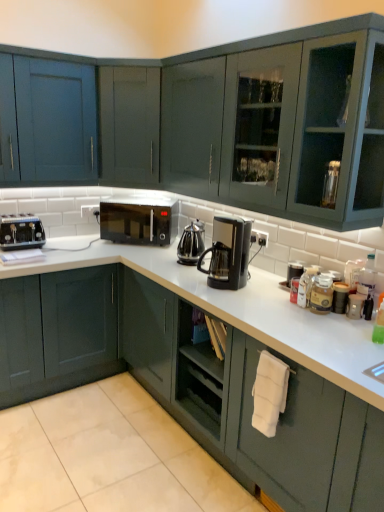
Find the location of a particular element. The height and width of the screenshot is (512, 384). matte black toaster at left is located at coordinates (21, 232).

Find the location of a particular element. The width and height of the screenshot is (384, 512). black plastic coffee maker at center is located at coordinates (228, 253).

The width and height of the screenshot is (384, 512). Describe the element at coordinates (57, 332) in the screenshot. I see `matte dark green cabinet at lower left, which ranks as the first cabinetry in bottom-to-top order` at that location.

This screenshot has width=384, height=512. What do you see at coordinates (288, 432) in the screenshot?
I see `white matte towel at lower right` at bounding box center [288, 432].

The height and width of the screenshot is (512, 384). I want to click on metallic silver canister at right, so click(355, 306).

Considering the positions of objects black matte microwave at center and metallic silver canister at right in the image provided, who is more to the right, black matte microwave at center or metallic silver canister at right?

metallic silver canister at right is more to the right.

Considering the sizes of objects black matte microwave at center and metallic silver canister at right in the image provided, who is bigger, black matte microwave at center or metallic silver canister at right?

With larger size is black matte microwave at center.

From a real-world perspective, is black matte microwave at center positioned under metallic silver canister at right based on gravity?

Actually, black matte microwave at center is physically above metallic silver canister at right in the real world.

Measure the distance between metallic silver canister at right and matte blue cabinet at upper left, placed as the first cabinetry when sorted from top to bottom.

metallic silver canister at right is 2.07 meters from matte blue cabinet at upper left, placed as the first cabinetry when sorted from top to bottom.

Does metallic silver canister at right have a greater width compared to matte blue cabinet at upper left, placed as the first cabinetry when sorted from top to bottom?

Incorrect, the width of metallic silver canister at right does not surpass that of matte blue cabinet at upper left, placed as the first cabinetry when sorted from top to bottom.

Based on their positions, is metallic silver canister at right located to the left or right of matte blue cabinet at upper left, acting as the second cabinetry starting from the bottom?

metallic silver canister at right is to the right of matte blue cabinet at upper left, acting as the second cabinetry starting from the bottom.

I want to click on cabinetry beneath the black matte microwave at center (from a real-world perspective), so click(x=57, y=332).

Is matte dark green cabinet at lower left, arranged as the second cabinetry when viewed from the top, next to black matte microwave at center?

No, matte dark green cabinet at lower left, arranged as the second cabinetry when viewed from the top, is not next to black matte microwave at center.

Is matte dark green cabinet at lower left, arranged as the second cabinetry when viewed from the top, shorter than black matte microwave at center?

Result: Incorrect, the height of matte dark green cabinet at lower left, arranged as the second cabinetry when viewed from the top, does not fall short of that of black matte microwave at center.

Can you tell me how much matte dark green cabinet at lower left, which ranks as the first cabinetry in bottom-to-top order, and black matte microwave at center differ in facing direction?

41.8 degrees separate the facing orientations of matte dark green cabinet at lower left, which ranks as the first cabinetry in bottom-to-top order, and black matte microwave at center.

Is matte blue cabinet at upper left, placed as the first cabinetry when sorted from top to bottom, placed right next to black plastic coffee pot at center?

They are not placed beside each other.

From the image's perspective, which is above, matte blue cabinet at upper left, placed as the first cabinetry when sorted from top to bottom, or black plastic coffee pot at center?

matte blue cabinet at upper left, placed as the first cabinetry when sorted from top to bottom, appears higher in the image.

Can you tell me how much matte blue cabinet at upper left, acting as the second cabinetry starting from the bottom, and black plastic coffee pot at center differ in facing direction?

The angular difference between matte blue cabinet at upper left, acting as the second cabinetry starting from the bottom, and black plastic coffee pot at center is 85.1 degrees.

How many degrees apart are the facing directions of matte black toaster at left and black matte microwave at center?

There is a 46.7-degree angle between the facing directions of matte black toaster at left and black matte microwave at center.

Considering the sizes of objects matte black toaster at left and black matte microwave at center in the image provided, who is wider, matte black toaster at left or black matte microwave at center?

black matte microwave at center is wider.

Does matte black toaster at left touch black matte microwave at center?

matte black toaster at left is not next to black matte microwave at center, and they're not touching.

Is black matte microwave at center a part of matte black toaster at left?

That's incorrect, black matte microwave at center is not inside matte black toaster at left.

From the picture: Considering the positions of objects matte blue cabinet at upper left, acting as the second cabinetry starting from the bottom, and black matte microwave at center in the image provided, who is behind, matte blue cabinet at upper left, acting as the second cabinetry starting from the bottom, or black matte microwave at center?

black matte microwave at center is behind.

Is matte blue cabinet at upper left, acting as the second cabinetry starting from the bottom, taller than black matte microwave at center?

Correct, matte blue cabinet at upper left, acting as the second cabinetry starting from the bottom, is much taller as black matte microwave at center.

Is matte blue cabinet at upper left, acting as the second cabinetry starting from the bottom, looking in the opposite direction of black matte microwave at center?

matte blue cabinet at upper left, acting as the second cabinetry starting from the bottom, is not turned away from black matte microwave at center.

Does point (62, 150) appear closer or farther from the camera than point (135, 207)?

Point (62, 150) is positioned closer to the camera compared to point (135, 207).

From a real-world perspective, is black plastic coffee maker at center physically located above or below matte black toaster at left?

black plastic coffee maker at center is situated higher than matte black toaster at left in the real world.

Considering the positions of point (250, 224) and point (13, 220), is point (250, 224) closer or farther from the camera than point (13, 220)?

Point (250, 224).

Considering the sizes of black plastic coffee maker at center and matte black toaster at left in the image, is black plastic coffee maker at center taller or shorter than matte black toaster at left?

Clearly, black plastic coffee maker at center is taller compared to matte black toaster at left.

Looking at this image, is black plastic coffee maker at center completely or partially outside of matte black toaster at left?

Yes, black plastic coffee maker at center is located beyond the bounds of matte black toaster at left.

The width and height of the screenshot is (384, 512). Find the location of `appliance below the black matte microwave at center (from a real-world perspective)`. appliance below the black matte microwave at center (from a real-world perspective) is located at coordinates (355, 306).

This screenshot has width=384, height=512. I want to click on appliance that is in front of the matte blue cabinet at upper left, acting as the second cabinetry starting from the bottom, so click(x=355, y=306).

Looking at the image, which one is located closer to matte dark green cabinet at lower left, which ranks as the first cabinetry in bottom-to-top order, matte black toaster at left or matte blue cabinet at upper left, placed as the first cabinetry when sorted from top to bottom?

Among the two, matte black toaster at left is located nearer to matte dark green cabinet at lower left, which ranks as the first cabinetry in bottom-to-top order.

When comparing their distances from black plastic coffee pot at center, does white matte towel at lower right or matte blue cabinet at upper left, acting as the second cabinetry starting from the bottom, seem further?

matte blue cabinet at upper left, acting as the second cabinetry starting from the bottom.

In the scene shown: Estimate the real-world distances between objects in this image. Which object is further from matte dark green cabinet at lower left, arranged as the second cabinetry when viewed from the top, metallic silver canister at right or matte blue cabinet at upper left, placed as the first cabinetry when sorted from top to bottom?

metallic silver canister at right.

Based on their spatial positions, is black matte microwave at center or metallic silver canister at right closer to black plastic coffee maker at center?

metallic silver canister at right is positioned closer to the anchor black plastic coffee maker at center.

Estimate the real-world distances between objects in this image. Which object is closer to black matte microwave at center, matte blue cabinet at upper left, placed as the first cabinetry when sorted from top to bottom, or matte black toaster at left?

Among the two, matte blue cabinet at upper left, placed as the first cabinetry when sorted from top to bottom, is located nearer to black matte microwave at center.

Considering their positions, is white matte towel at lower right positioned further to matte blue cabinet at upper left, acting as the second cabinetry starting from the bottom, than black plastic coffee maker at center?

white matte towel at lower right lies further to matte blue cabinet at upper left, acting as the second cabinetry starting from the bottom, than the other object.

Which object lies nearer to the anchor point matte dark green cabinet at lower left, which ranks as the first cabinetry in bottom-to-top order, metallic silver canister at right or black plastic coffee maker at center?

black plastic coffee maker at center lies closer to matte dark green cabinet at lower left, which ranks as the first cabinetry in bottom-to-top order, than the other object.

Which object lies nearer to the anchor point black matte microwave at center, black plastic coffee maker at center or matte black toaster at left?

matte black toaster at left is positioned closer to the anchor black matte microwave at center.

You are a GUI agent. You are given a task and a screenshot of the screen. Output one action in this format:
    pyautogui.click(x=<x>, y=<y>)
    Task: Click on the appliance between white matte towel at lower right and black matte microwave at center along the z-axis
    The height and width of the screenshot is (512, 384).
    Given the screenshot: What is the action you would take?
    pyautogui.click(x=355, y=306)

What are the coordinates of `coffeepot situated between matte dark green cabinet at lower left, which ranks as the first cabinetry in bottom-to-top order, and white matte towel at lower right from left to right` in the screenshot? It's located at click(191, 243).

Locate an element on the screen. home appliance between matte dark green cabinet at lower left, arranged as the second cabinetry when viewed from the top, and white matte towel at lower right, in the horizontal direction is located at coordinates (228, 253).

You are a GUI agent. You are given a task and a screenshot of the screen. Output one action in this format:
    pyautogui.click(x=<x>, y=<y>)
    Task: Click on the kitchen appliance between matte blue cabinet at upper left, placed as the first cabinetry when sorted from top to bottom, and matte dark green cabinet at lower left, which ranks as the first cabinetry in bottom-to-top order, vertically
    Image resolution: width=384 pixels, height=512 pixels.
    Given the screenshot: What is the action you would take?
    pyautogui.click(x=21, y=232)